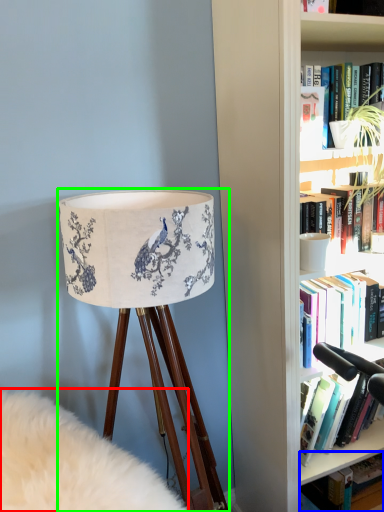
Question: Which object is positioned closest to plain (highlighted by a red box)? Select from book (highlighted by a blue box) and lamp (highlighted by a green box).

Choices:
 (A) book
 (B) lamp

Answer: (B)